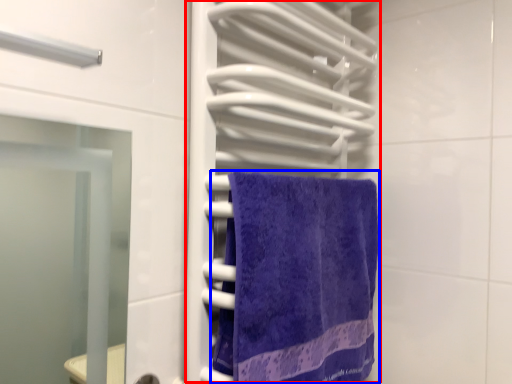
Question: Which object appears closest to the camera in this image, closet (highlighted by a red box) or towel (highlighted by a blue box)?

Choices:
 (A) closet
 (B) towel

Answer: (A)